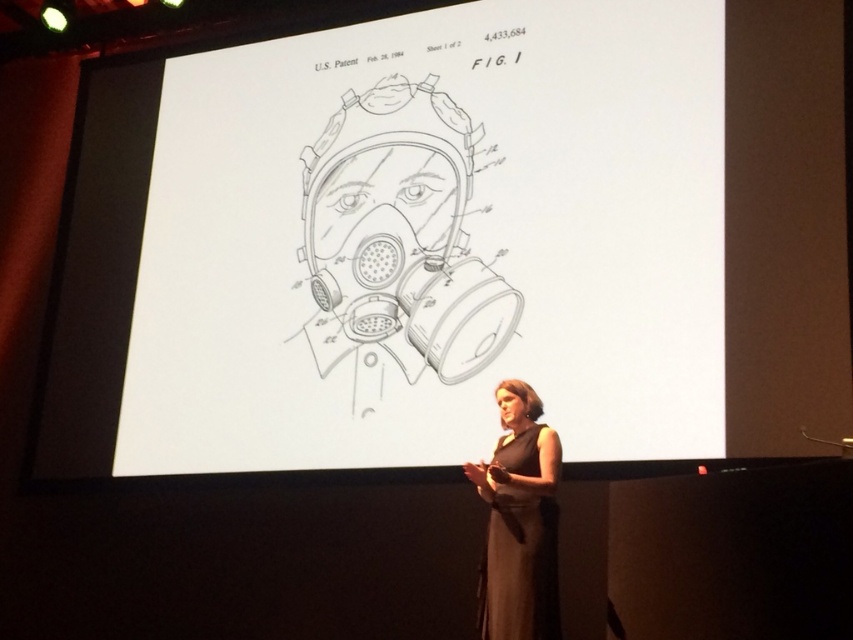
Question: Is white paper at center thinner than dark gray dress at center?

Choices:
 (A) yes
 (B) no

Answer: (B)

Question: Among these points, which one is farthest from the camera?

Choices:
 (A) (554, 588)
 (B) (106, 394)

Answer: (B)

Question: Can you confirm if white paper at center is positioned below dark gray dress at center?

Choices:
 (A) yes
 (B) no

Answer: (B)

Question: Is white paper at center wider than dark gray dress at center?

Choices:
 (A) yes
 (B) no

Answer: (A)